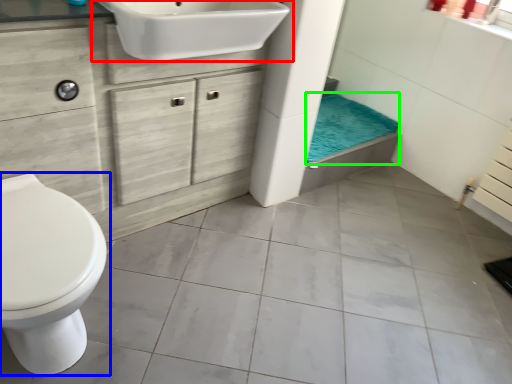
Question: Estimate the real-world distances between objects in this image. Which object is closer to sink (highlighted by a red box), toilet (highlighted by a blue box) or bath towel (highlighted by a green box)?

Choices:
 (A) toilet
 (B) bath towel

Answer: (A)